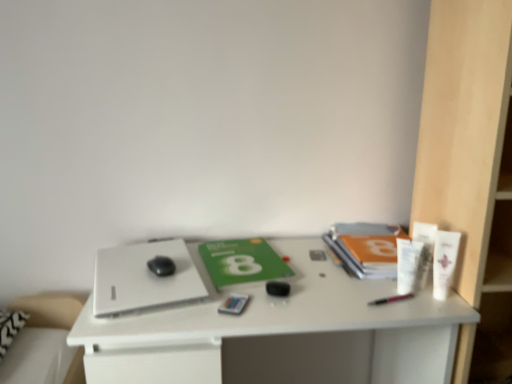
The height and width of the screenshot is (384, 512). Find the location of `vacant space situated above white matte laptop at left (from a real-world perspective)`. vacant space situated above white matte laptop at left (from a real-world perspective) is located at coordinates (142, 268).